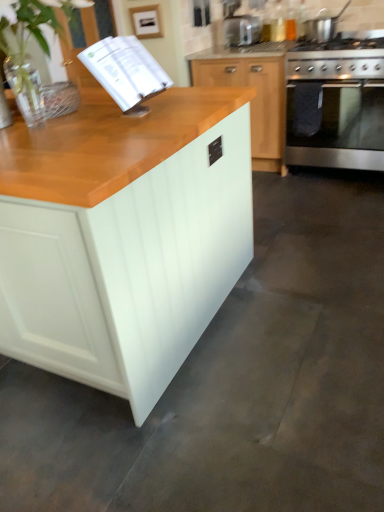
Identify the location of empty space that is ontop of satin silver toaster at upper center (from a real-world perspective). (240, 15).